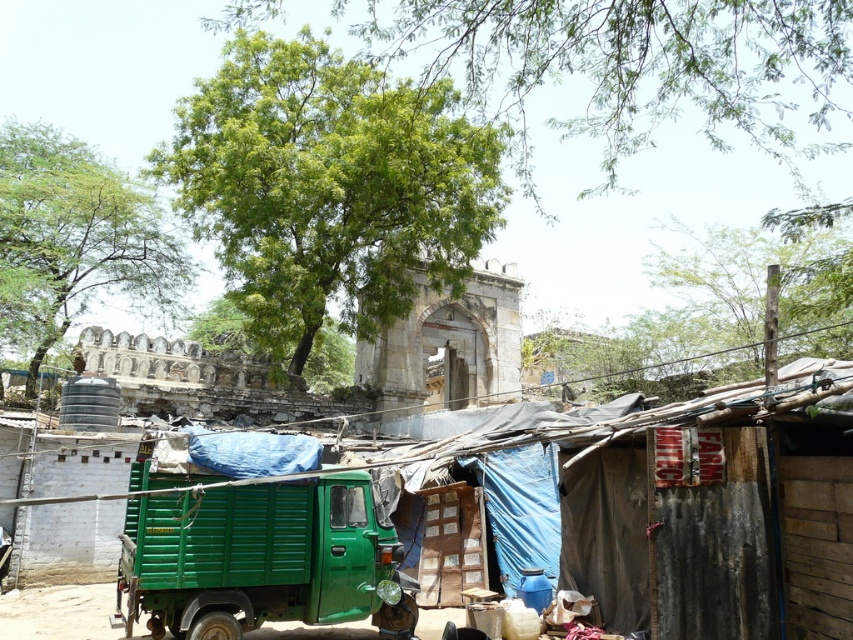
Looking at this image, you are planning to plant a new vegetable garden in the dirt field at lower left. Considering the presence of the green leafy tree at upper right, which object might cast a shadow over the garden area and why?

The green leafy tree at upper right might cast a shadow over the garden area because it has a larger size compared to the dirt field at lower left, which means its shadow could cover more ground.

You are a farmer planning to plant crops in the dirt field at lower left. Considering the green leafy tree at upper left, which has a wider spread, do you think the tree might cast enough shade to affect your crops?

The green leafy tree at upper left has a wider spread than the dirt field at lower left, so it is likely that the tree casts sufficient shade over the dirt field at lower left, potentially affecting the crops.

You are a farmer planning to plant crops in the dirt field at lower left. Considering the size of the green leafy tree at center, will it cast enough shade to protect your crops from the sun?

The green leafy tree at center is bigger than the dirt field at lower left, so it will cast enough shade to protect the crops from the sun.